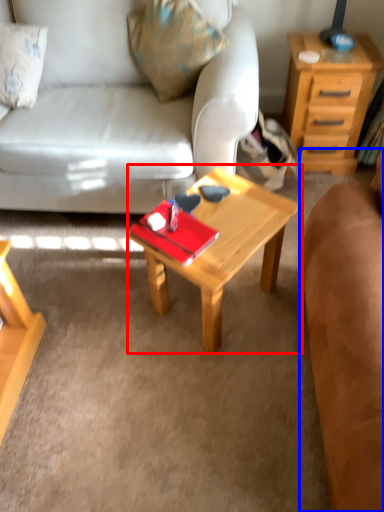
Question: Among these objects, which one is farthest to the camera, coffee table (highlighted by a red box) or studio couch (highlighted by a blue box)?

Choices:
 (A) coffee table
 (B) studio couch

Answer: (A)